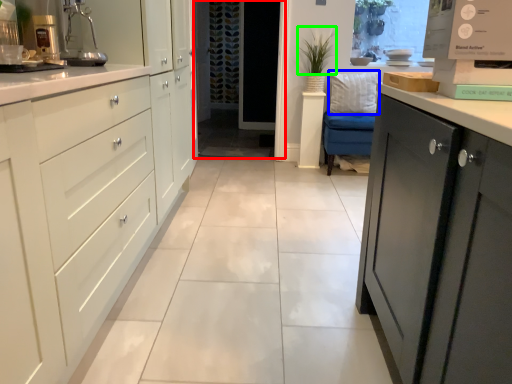
Question: Considering the real-world distances, which object is farthest from screen door (highlighted by a red box)? pillow (highlighted by a blue box) or plant (highlighted by a green box)?

Choices:
 (A) pillow
 (B) plant

Answer: (A)